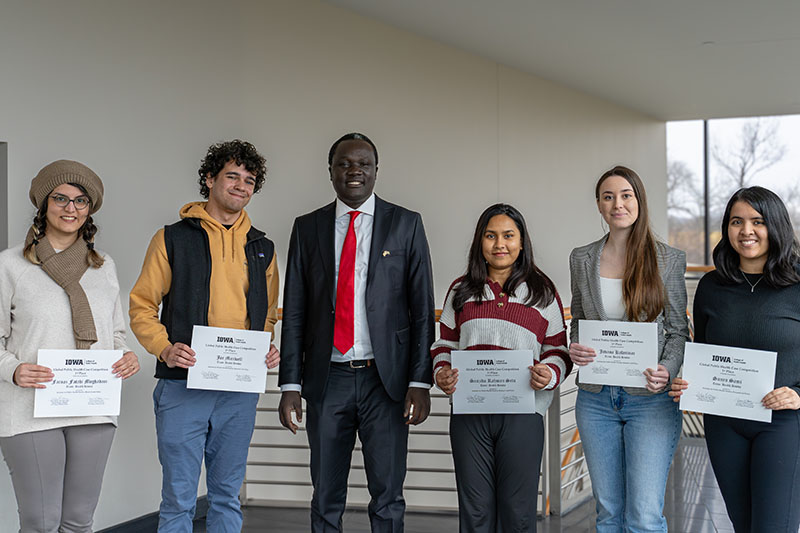
You are a GUI agent. You are given a task and a screenshot of the screen. Output one action in this format:
    pyautogui.click(x=<x>, y=<y>)
    Task: Click on the gray floor
    This screenshot has height=533, width=800.
    Given the screenshot: What is the action you would take?
    pyautogui.click(x=690, y=496), pyautogui.click(x=282, y=508)